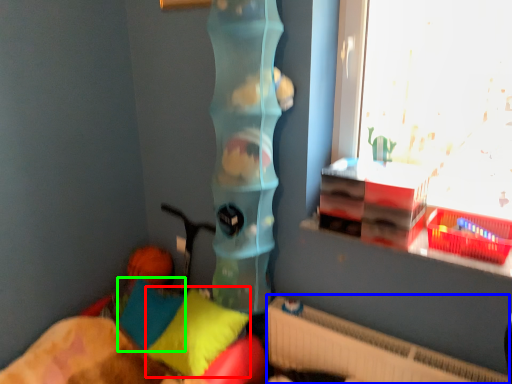
Question: Which object is the farthest from pillow (highlighted by a red box)? Choose among these: radiator (highlighted by a blue box) or pillow (highlighted by a green box).

Choices:
 (A) radiator
 (B) pillow

Answer: (A)